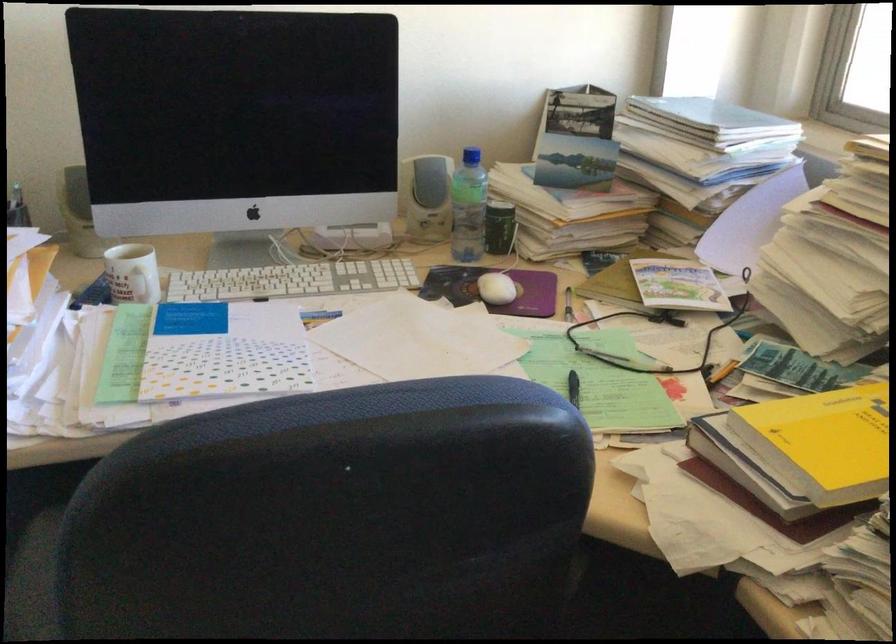
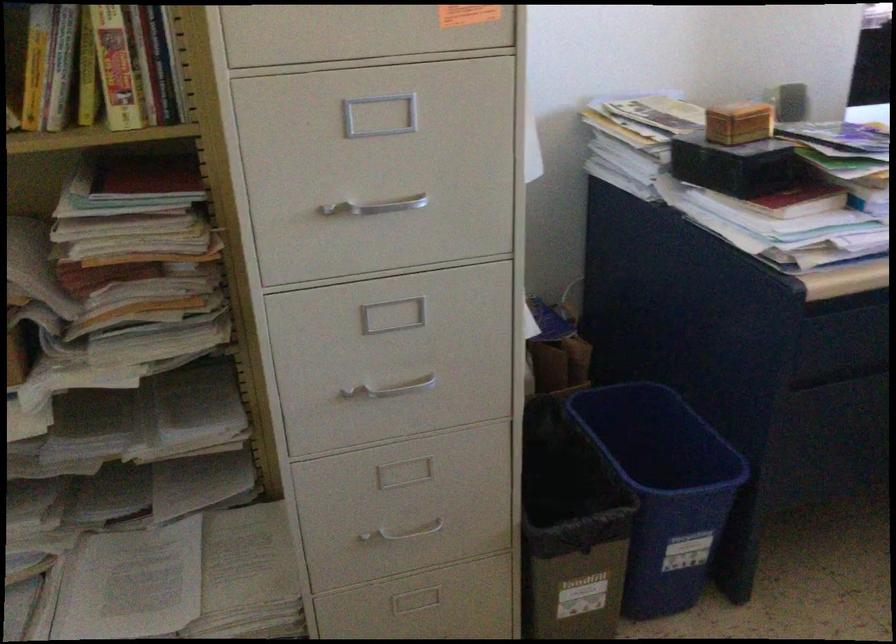
Question: In a continuous first-person perspective shot, in which direction is the camera moving?

Choices:
 (A) Left
 (B) Right
 (C) Forward
 (D) Backward

Answer: (A)